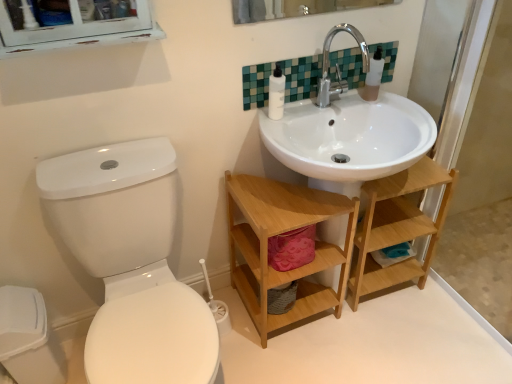
At what (x,y) coordinates should I click in order to perform the action: click on free space in front of white plastic bottle at upper center. Please return your answer as a coordinate pair (x, y). The height and width of the screenshot is (384, 512). Looking at the image, I should click on (284, 136).